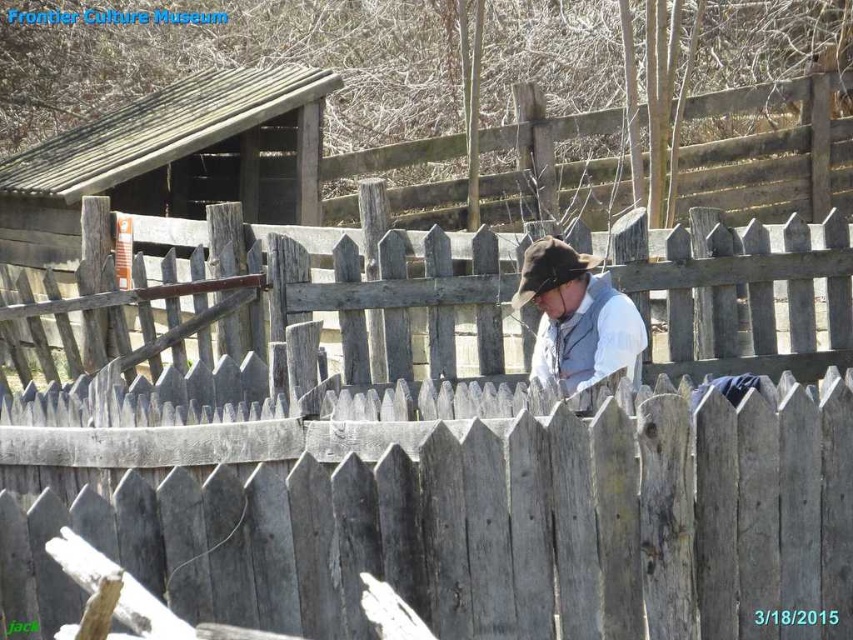
Question: Does white cotton shirt at center appear on the left side of brown felt cowboy hat at center?

Choices:
 (A) yes
 (B) no

Answer: (B)

Question: Is white cotton shirt at center above brown felt cowboy hat at center?

Choices:
 (A) no
 (B) yes

Answer: (A)

Question: Among these objects, which one is farthest from the camera?

Choices:
 (A) brown felt cowboy hat at center
 (B) white cotton shirt at center

Answer: (A)

Question: Which of the following is the closest to the observer?

Choices:
 (A) (563, 301)
 (B) (527, 280)

Answer: (B)

Question: Which point is farther from the camera taking this photo?

Choices:
 (A) (604, 336)
 (B) (554, 252)

Answer: (A)

Question: Is white cotton shirt at center wider than brown felt cowboy hat at center?

Choices:
 (A) no
 (B) yes

Answer: (B)